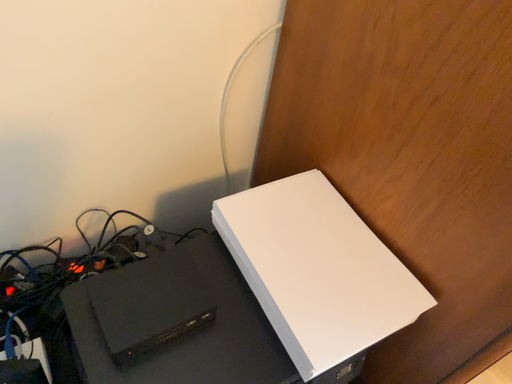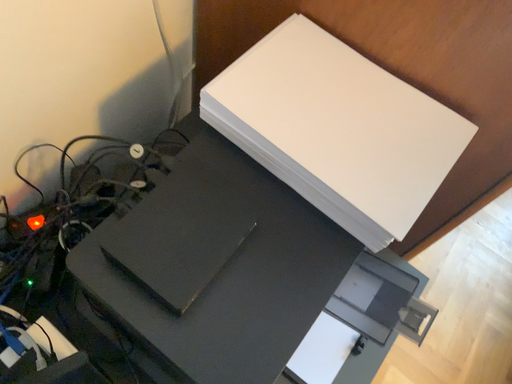
Question: Which way did the camera rotate in the video?

Choices:
 (A) rotated upward
 (B) rotated downward

Answer: (B)